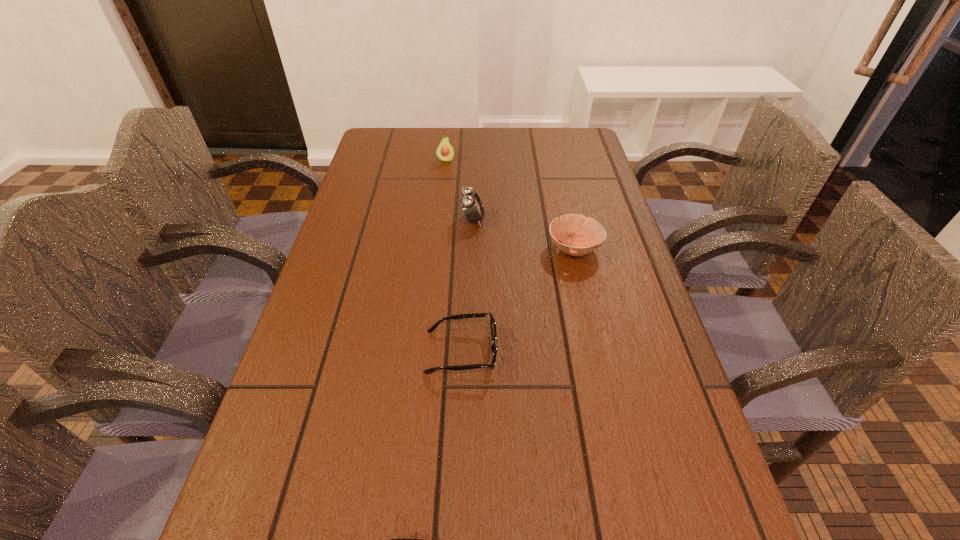
At what (x,y) coordinates should I click in order to perform the action: click on vacant space located on the front of the bowl. Please return your answer as a coordinate pair (x, y). Looking at the image, I should click on (606, 387).

Identify the location of free spot located 0.130m on the lenses of the second nearest object. (563, 352).

Locate an element on the screen. object present at the far edge is located at coordinates (445, 151).

Where is `object located at the right edge`? The image size is (960, 540). object located at the right edge is located at coordinates (593, 233).

Identify the location of vacant space at the far edge of the desktop. (482, 131).

The width and height of the screenshot is (960, 540). Identify the location of free region at the left edge of the desktop. click(x=386, y=265).

Find the location of `vacant space at the right edge of the desktop`. vacant space at the right edge of the desktop is located at coordinates (581, 172).

This screenshot has height=540, width=960. What are the coordinates of `vacant space at the far right corner of the desktop` in the screenshot? It's located at (546, 158).

Where is `free spot between the fourth nearest object and the farthest object`? Image resolution: width=960 pixels, height=540 pixels. free spot between the fourth nearest object and the farthest object is located at coordinates (460, 190).

Image resolution: width=960 pixels, height=540 pixels. In order to click on vacant point located between the second nearest object and the avocado in this screenshot , I will do point(453,256).